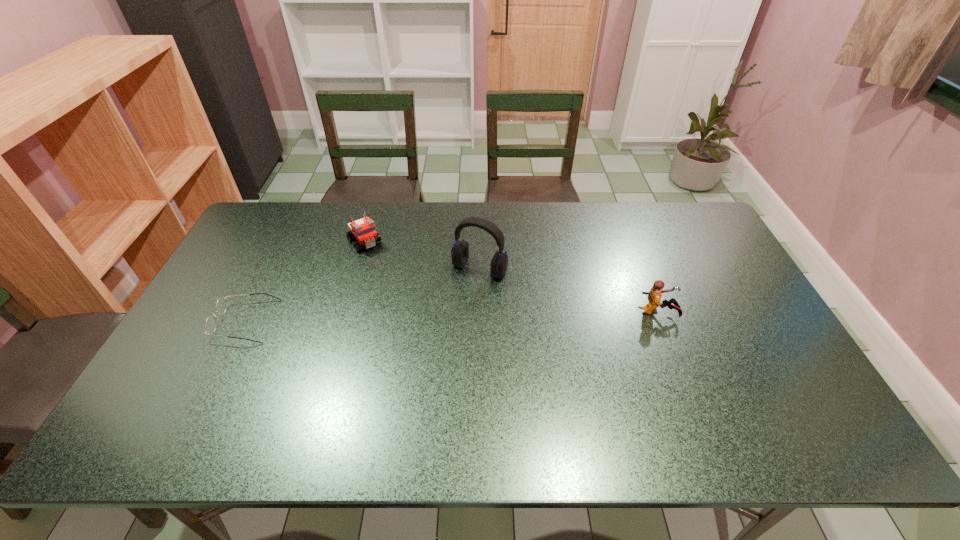
Where is `vacant spot on the desktop that is between the leftmost object and the nearer Lego and is positioned on the front-facing side of the second object from left to right`? The height and width of the screenshot is (540, 960). vacant spot on the desktop that is between the leftmost object and the nearer Lego and is positioned on the front-facing side of the second object from left to right is located at coordinates (422, 318).

Locate an element on the screen. The width and height of the screenshot is (960, 540). vacant space on the desktop that is between the leftmost object and the nearer Lego and is positioned on the headband of the second object from right to left is located at coordinates (448, 317).